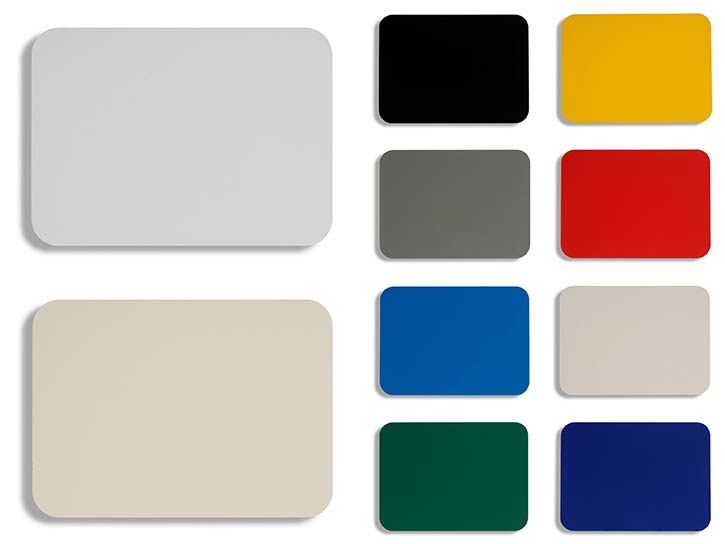
Locate an element on the screen. The width and height of the screenshot is (725, 544). tile colors for american flag is located at coordinates (657, 216), (468, 353), (314, 123), (273, 454), (576, 351).